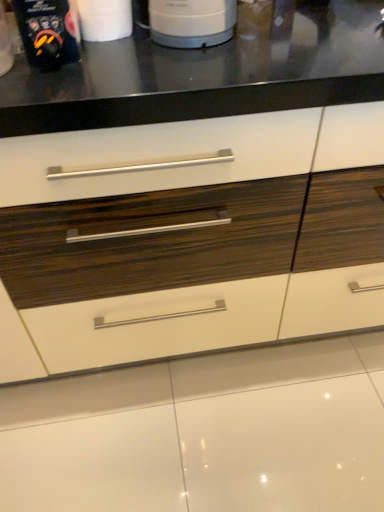
Locate an element on the screen. The image size is (384, 512). free space in front of matte black coffee maker at upper left is located at coordinates 69,92.